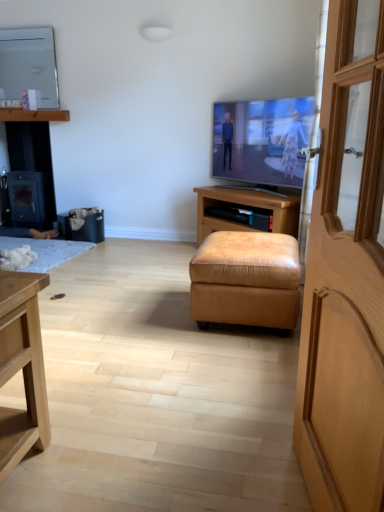
I want to click on free spot below wooden shelf at upper left, arranged as the second cabinetry when viewed from the right (from a real-world perspective), so click(38, 226).